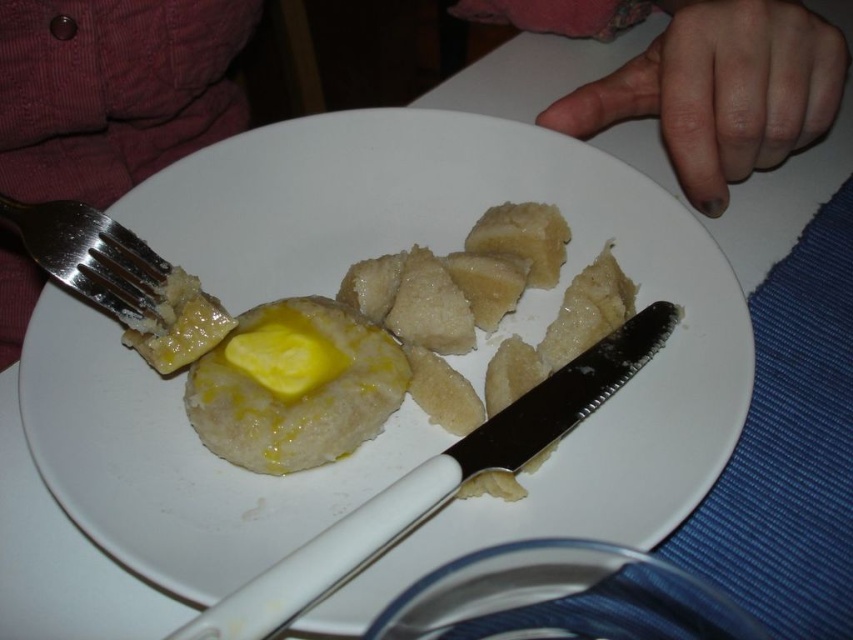
You are setting up a table for a small dinner party and need to arrange the utensils properly. According to the image, which utensil should be placed closer to the plate, the white plastic knife at center or the silver metallic fork at upper left?

The silver metallic fork at upper left should be placed closer to the plate because the white plastic knife at center is larger and typically placed farther away in a standard utensil arrangement.

You need to cut a piece of the dumpling but only have the white plastic knife at center and the silver metallic fork at upper left. Which tool should you choose and why?

You should choose the white plastic knife at center because its width is larger than the silver metallic fork at upper left, making it more suitable for cutting the dumpling.

You are a food critic analyzing the composition of the image. Based on the coordinates provided, where is the white matte plate at center located in the image?

The white matte plate at center is located at coordinates point (x=505, y=321).